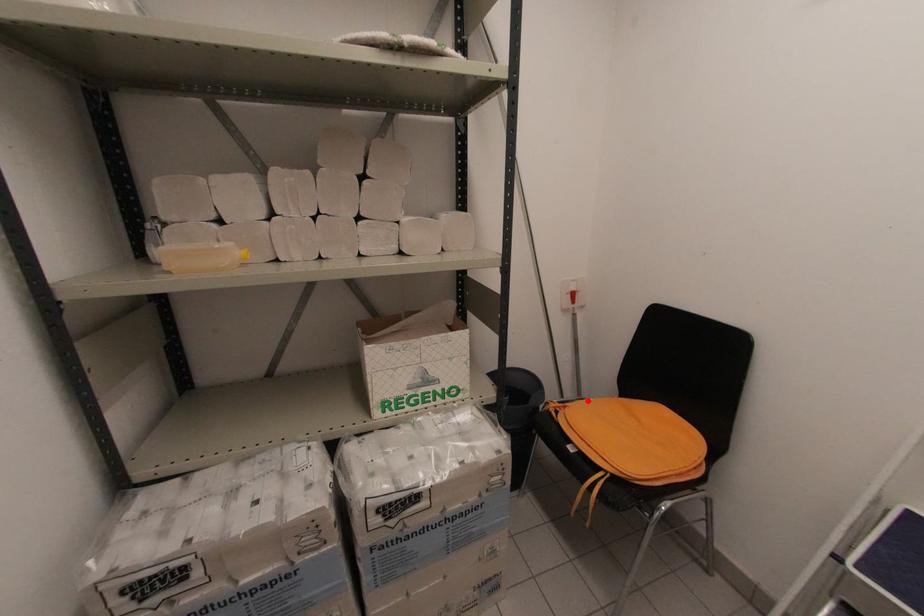
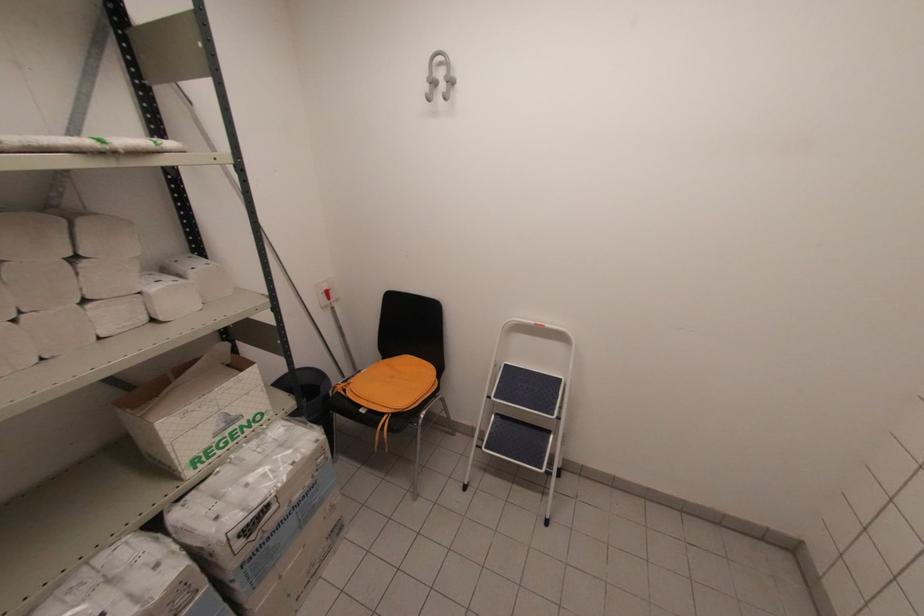
Question: A red point is marked in image1. In image2, is the corresponding 3D point closer to the camera or farther? Reply with the corresponding letter.

Choices:
 (A) The corresponding 3D point is closer.
 (B) The corresponding 3D point is farther.

Answer: (B)